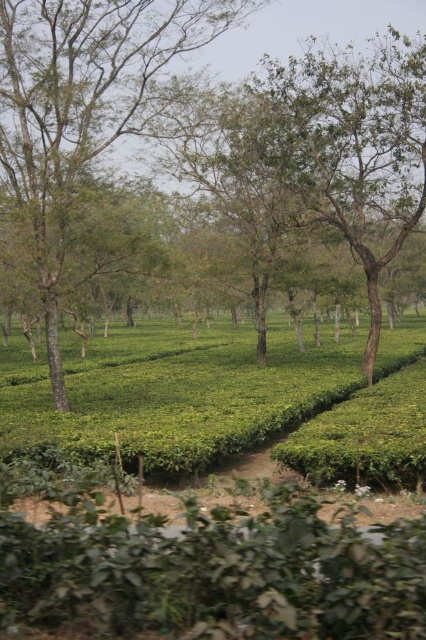
You are a gardener planning to plant a new row of tea bushes between the green leafy hedge at lower center and the green leafy tree at center. Based on their widths, which one should you place the new row closer to?

The green leafy hedge at lower center might be wider than the green leafy tree at center, so the new row should be placed closer to the tree to ensure there is enough space for the hedge.

You are a landscape architect designing a garden path that needs to pass between the green leafy hedge at lower center and the green leafy tree at center. The path must be wide enough for a wheelbarrow. Considering their sizes, which object might require more space to avoid encroaching on its base?

The green leafy hedge at lower center is bigger than the green leafy tree at center, so it might require more space to avoid encroaching on its base when designing the garden path.

You are a gardener standing at the edge of the tea plantation. You need to water both the green leafy hedge at lower center and the green leafy tree at center. If your watering can holds enough water for 15 meters of travel, can you water both without refilling?

The green leafy hedge at lower center is 13.93 meters away from the green leafy tree at center. Since the distance between them is less than 15 meters, you can water both without needing to refill your watering can.